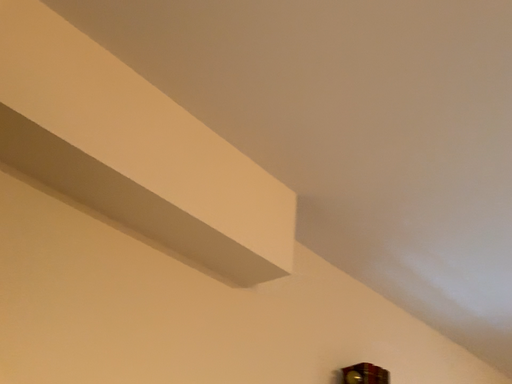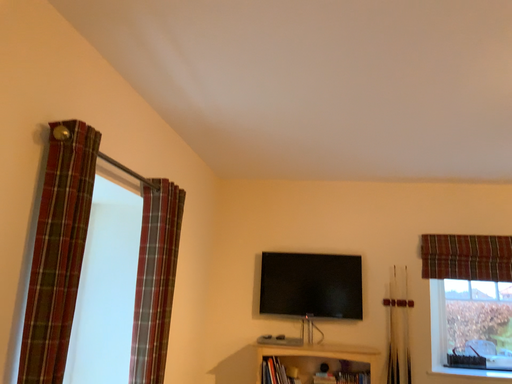
Question: Which way did the camera rotate in the video?

Choices:
 (A) rotated downward
 (B) rotated upward

Answer: (A)